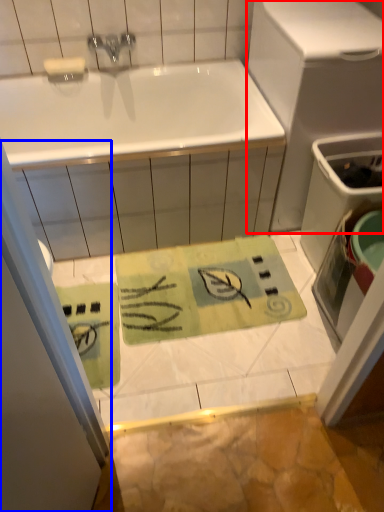
Question: Which object appears farthest to the camera in this image, appliance (highlighted by a red box) or shower door (highlighted by a blue box)?

Choices:
 (A) appliance
 (B) shower door

Answer: (A)